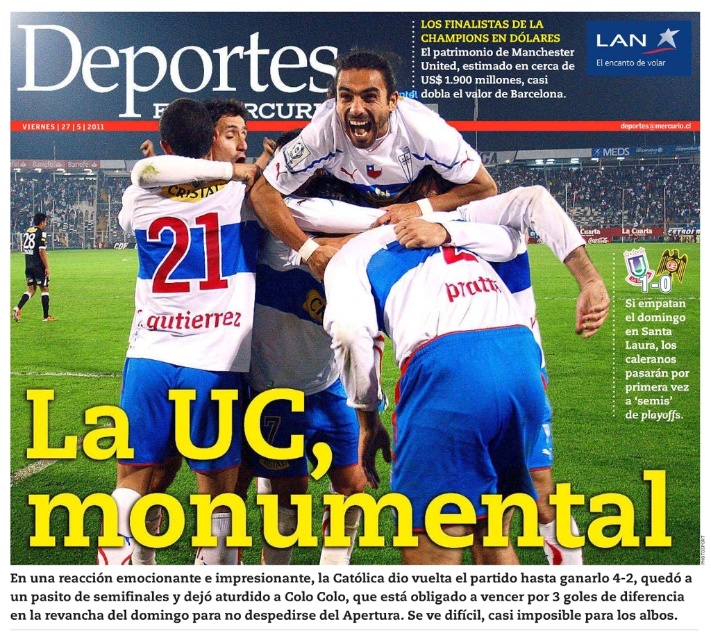
Question: Estimate the real-world distances between objects in this image. Which object is farther from the black jersey at lower left?

Choices:
 (A) white jersey at center
 (B) white matte jersey at center

Answer: (B)

Question: Is white matte jersey at center bigger than black jersey at lower left?

Choices:
 (A) no
 (B) yes

Answer: (A)

Question: Which of the following is the closest to the observer?

Choices:
 (A) black jersey at lower left
 (B) white jersey at center
 (C) white matte jersey at center

Answer: (B)

Question: Among these points, which one is nearest to the camera?

Choices:
 (A) (26, 237)
 (B) (385, 177)

Answer: (B)

Question: Is white jersey at center to the right of black jersey at lower left from the viewer's perspective?

Choices:
 (A) no
 (B) yes

Answer: (B)

Question: Does white jersey at center have a greater width compared to black jersey at lower left?

Choices:
 (A) no
 (B) yes

Answer: (A)